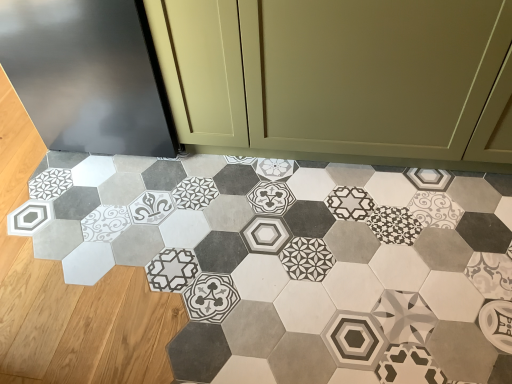
This screenshot has width=512, height=384. Find the location of `vacant area situated below patterned hexagonal tile at center (from a real-world perspective)`. vacant area situated below patterned hexagonal tile at center (from a real-world perspective) is located at coordinates (303, 252).